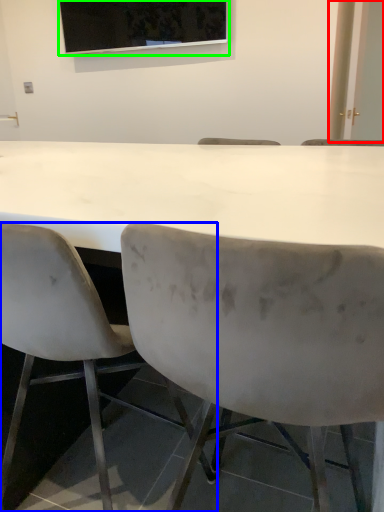
Question: Which object is the farthest from glass door (highlighted by a red box)? Choose among these: chair (highlighted by a blue box) or projection screen (highlighted by a green box).

Choices:
 (A) chair
 (B) projection screen

Answer: (A)